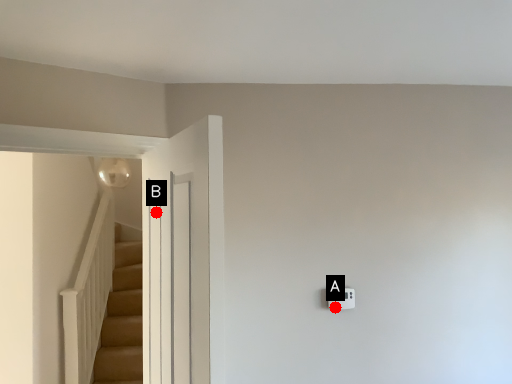
Question: Two points are circled on the image, labeled by A and B beside each circle. Which point appears farthest from the camera in this image?

Choices:
 (A) A is further
 (B) B is further

Answer: (A)